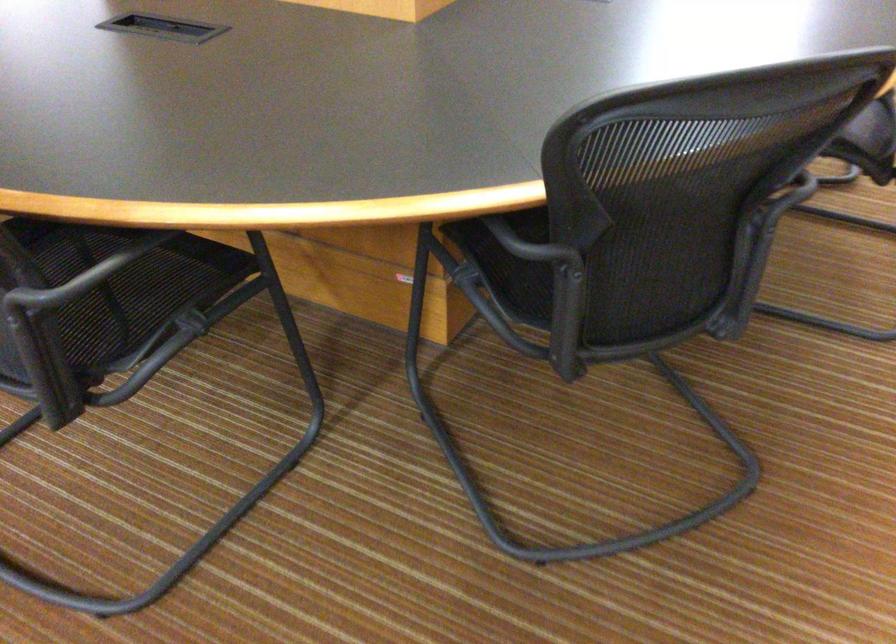
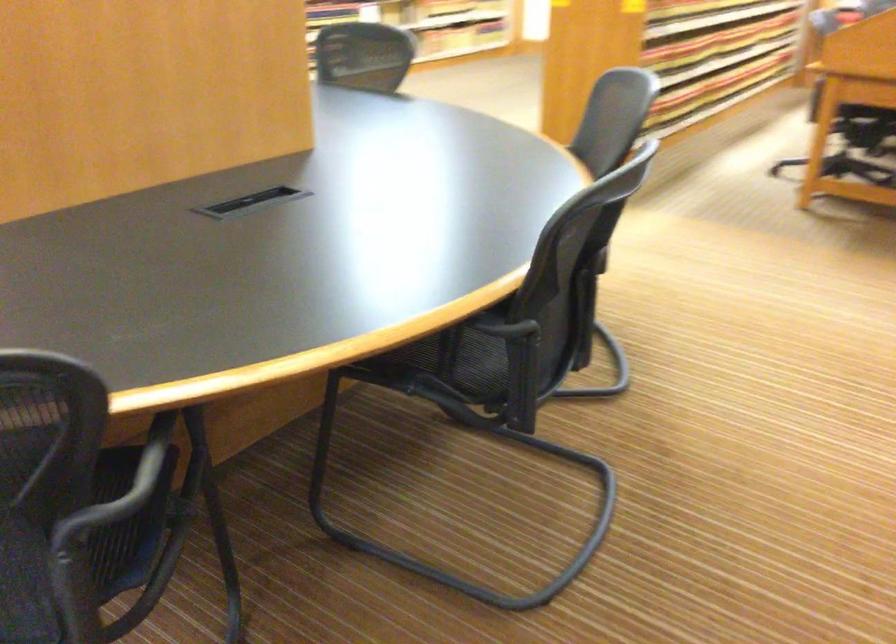
Find the pixel in the second image that matches [797,178] in the first image.

(151, 460)